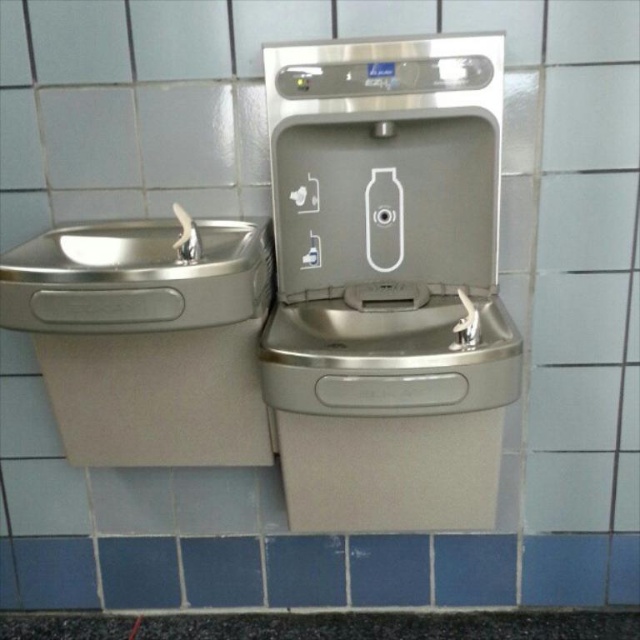
Question: Which object is farther from the camera taking this photo?

Choices:
 (A) blue tile at center
 (B) satin nickel faucet at upper center

Answer: (A)

Question: From the image, what is the correct spatial relationship of satin nickel faucet at upper center in relation to brushed metal sink at left?

Choices:
 (A) above
 (B) below

Answer: (A)

Question: Which point is closer to the camera taking this photo?

Choices:
 (A) (20, 317)
 (B) (342, 557)
 (C) (497, 259)

Answer: (A)

Question: Which object is the farthest from the brushed metal sink at left?

Choices:
 (A) satin nickel faucet at upper center
 (B) blue tile at center

Answer: (B)

Question: Is brushed metal sink at left thinner than blue tile at center?

Choices:
 (A) no
 (B) yes

Answer: (A)

Question: Is the position of brushed metal sink at left less distant than that of blue tile at center?

Choices:
 (A) yes
 (B) no

Answer: (A)